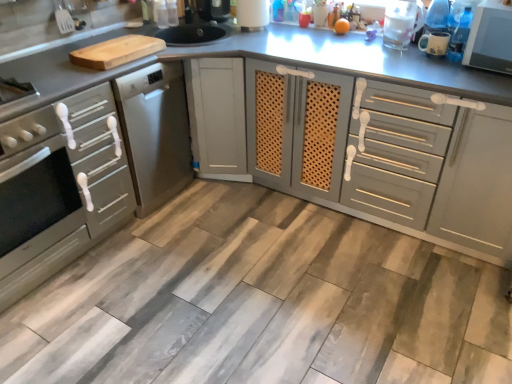
Find the location of `unoccupied area in front of transparent plastic pitcher at upper right, the second appliance positioned from the right`. unoccupied area in front of transparent plastic pitcher at upper right, the second appliance positioned from the right is located at coordinates (396, 58).